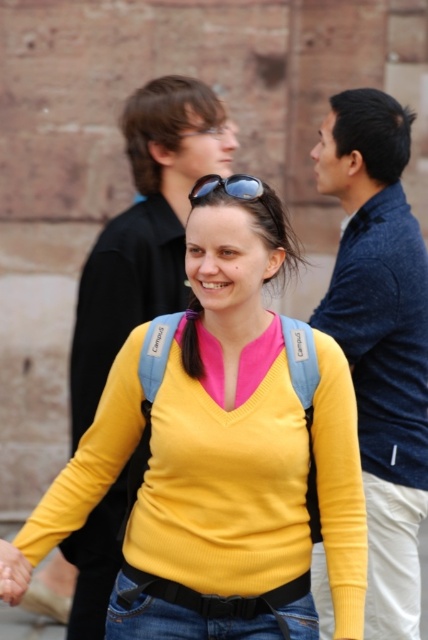
Question: Does jeans at center have a greater width compared to sunglasses at center?

Choices:
 (A) yes
 (B) no

Answer: (A)

Question: Based on their relative distances, which object is farther from the denim jacket at right?

Choices:
 (A) matte black jacket at upper left
 (B) sunglasses at center

Answer: (B)

Question: Which object appears closest to the camera in this image?

Choices:
 (A) yellow ribbed sweater at center
 (B) denim jacket at right
 (C) jeans at center
 (D) matte black jacket at upper left

Answer: (A)

Question: Among these objects, which one is nearest to the camera?

Choices:
 (A) sunglasses at center
 (B) yellow ribbed sweater at center

Answer: (B)

Question: Where is jeans at center located in relation to sunglasses at center in the image?

Choices:
 (A) left
 (B) right

Answer: (A)

Question: From the image, what is the correct spatial relationship of jeans at center in relation to sunglasses at center?

Choices:
 (A) right
 (B) left

Answer: (B)